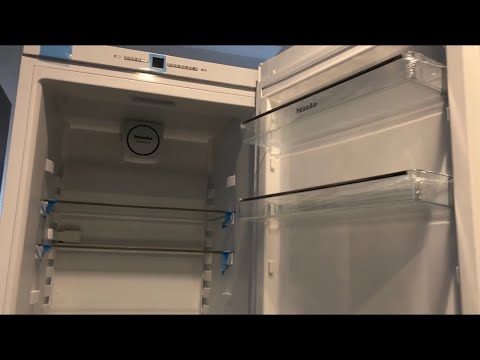
At what (x,y) coordinates should I click in order to perform the action: click on shelf slots. Please return your answer as a coordinate pair (x, y). The height and width of the screenshot is (360, 480). Looking at the image, I should click on (204, 286), (210, 239), (214, 194), (64, 185), (49, 275).